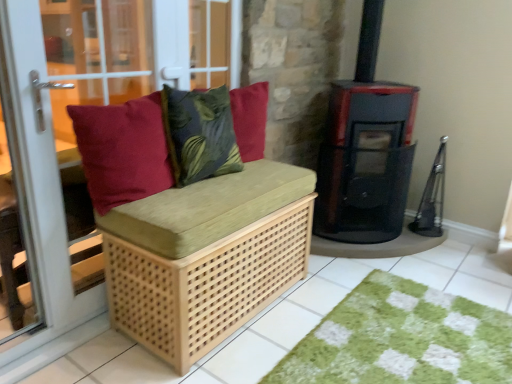
This screenshot has width=512, height=384. I want to click on natural wood bench cushion at center, so click(x=191, y=227).

Measure the distance between green shaggy rug at lower right and camera.

5.33 feet.

You are a GUI agent. You are given a task and a screenshot of the screen. Output one action in this format:
    pyautogui.click(x=<x>, y=<y>)
    Task: Click on the natural wood bench cushion at center
    This screenshot has width=512, height=384.
    Given the screenshot: What is the action you would take?
    pyautogui.click(x=191, y=227)

Could you tell me if green shaggy rug at lower right is facing black glossy wood burning stove at right?

No, green shaggy rug at lower right is not turned towards black glossy wood burning stove at right.

Based on their positions, is green shaggy rug at lower right located to the left or right of black glossy wood burning stove at right?

Based on their positions, green shaggy rug at lower right is located to the left of black glossy wood burning stove at right.

Consider the image. Measure the distance between green shaggy rug at lower right and black glossy wood burning stove at right.

green shaggy rug at lower right and black glossy wood burning stove at right are 33.01 inches apart from each other.

Would you say black glossy wood burning stove at right is part of green shaggy rug at lower right's contents?

No, green shaggy rug at lower right does not contain black glossy wood burning stove at right.

Could you tell me if black matte stove at center right is facing matte red cushion at left?

No, black matte stove at center right does not turn towards matte red cushion at left.

Considering the relative sizes of black matte stove at center right and matte red cushion at left in the image provided, is black matte stove at center right smaller than matte red cushion at left?

Actually, black matte stove at center right might be larger than matte red cushion at left.

Are black matte stove at center right and matte red cushion at left far apart?

black matte stove at center right is far away from matte red cushion at left.

Is black glossy wood burning stove at right surrounding matte red cushion at left?

Definitely not — matte red cushion at left is not inside black glossy wood burning stove at right.

What's the angular difference between black glossy wood burning stove at right and matte red cushion at left's facing directions?

46 degrees separate the facing orientations of black glossy wood burning stove at right and matte red cushion at left.

Is point (377, 192) behind point (122, 164)?

Yes, it is.

In terms of width, does black glossy wood burning stove at right look wider or thinner when compared to matte red cushion at left?

black glossy wood burning stove at right is wider than matte red cushion at left.

Is black matte stove at center right aimed at velvety green leaf-patterned pillow at center?

No, black matte stove at center right is not oriented towards velvety green leaf-patterned pillow at center.

Is black matte stove at center right beside velvety green leaf-patterned pillow at center?

There is a gap between black matte stove at center right and velvety green leaf-patterned pillow at center.

From a real-world perspective, is black matte stove at center right located beneath velvety green leaf-patterned pillow at center?

Yes.

Where is `throw pillow above the black matte stove at center right (from the image's perspective)`? throw pillow above the black matte stove at center right (from the image's perspective) is located at coordinates [x=199, y=134].

How different are the orientations of matte red cushion at left and green shaggy rug at lower right in degrees?

The angular difference between matte red cushion at left and green shaggy rug at lower right is 180 degrees.

Which object is positioned more to the right, matte red cushion at left or green shaggy rug at lower right?

green shaggy rug at lower right.

Would you say matte red cushion at left is a long distance from green shaggy rug at lower right?

matte red cushion at left is positioned a significant distance from green shaggy rug at lower right.

From a real-world perspective, is matte red cushion at left located beneath green shaggy rug at lower right?

No, from a real-world perspective, matte red cushion at left is not below green shaggy rug at lower right.

Is black glossy wood burning stove at right wider or thinner than natural wood bench cushion at center?

In the image, black glossy wood burning stove at right appears to be wider than natural wood bench cushion at center.

Is black glossy wood burning stove at right next to natural wood bench cushion at center and touching it?

No.

Measure the distance from black glossy wood burning stove at right to natural wood bench cushion at center.

They are 85.06 centimeters apart.

Which object is further away from the camera, black glossy wood burning stove at right or natural wood bench cushion at center?

black glossy wood burning stove at right is further from the camera.

Which object is wider, matte red cushion at left or natural wood bench cushion at center?

natural wood bench cushion at center is wider.

At what (x,y) coordinates should I click in order to perform the action: click on furniture on the right of matte red cushion at left. Please return your answer as a coordinate pair (x, y). The height and width of the screenshot is (384, 512). Looking at the image, I should click on (191, 227).

Is matte red cushion at left smaller than natural wood bench cushion at center?

Indeed, matte red cushion at left has a smaller size compared to natural wood bench cushion at center.

The width and height of the screenshot is (512, 384). Find the location of `wood burning stove above the green shaggy rug at lower right (from the image's perspective)`. wood burning stove above the green shaggy rug at lower right (from the image's perspective) is located at coordinates (368, 162).

Identify the location of stove behind the matte red cushion at left. The width and height of the screenshot is (512, 384). (365, 162).

When comparing their distances from matte red cushion at left, does natural wood bench at left or black glossy wood burning stove at right seem further?

black glossy wood burning stove at right.

Based on the photo, from the image, which object appears to be nearer to natural wood bench cushion at center, black matte stove at center right or green shaggy rug at lower right?

The object closer to natural wood bench cushion at center is green shaggy rug at lower right.

Based on their spatial positions, is natural wood bench at left or black glossy wood burning stove at right closer to green shaggy rug at lower right?

Among the two, black glossy wood burning stove at right is located nearer to green shaggy rug at lower right.

In the scene shown: Looking at the image, which one is located further to black matte stove at center right, green shaggy rug at lower right or matte red cushion at left?

matte red cushion at left lies further to black matte stove at center right than the other object.

Estimate the real-world distances between objects in this image. Which object is further from matte wood bench at left, natural wood bench cushion at center or green shaggy rug at lower right?

green shaggy rug at lower right is positioned further to the anchor matte wood bench at left.

Considering their positions, is black glossy wood burning stove at right positioned further to natural wood bench cushion at center than natural wood bench at left?

black glossy wood burning stove at right lies further to natural wood bench cushion at center than the other object.

Based on their spatial positions, is matte wood bench at left or natural wood bench cushion at center closer to green shaggy rug at lower right?

Among the two, natural wood bench cushion at center is located nearer to green shaggy rug at lower right.

Which object lies further to the anchor point green shaggy rug at lower right, matte wood bench at left or velvety green leaf-patterned pillow at center?

matte wood bench at left is further to green shaggy rug at lower right.

Locate an element on the screen. The image size is (512, 384). stove between matte red cushion at left and black glossy wood burning stove at right is located at coordinates (365, 162).

This screenshot has height=384, width=512. I want to click on pillow between natural wood bench at left and green shaggy rug at lower right in the horizontal direction, so click(x=122, y=151).

This screenshot has height=384, width=512. What are the coordinates of `throw pillow between natural wood bench at left and natural wood bench cushion at center` in the screenshot? It's located at (199, 134).

This screenshot has width=512, height=384. In order to click on furniture between velvety green leaf-patterned pillow at center and black glossy wood burning stove at right in this screenshot , I will do `click(191, 227)`.